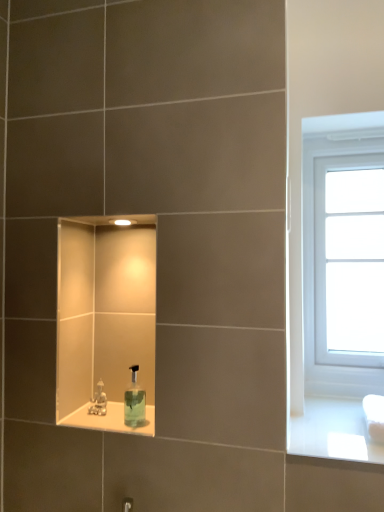
Question: Does transparent plastic soap dispenser at center contain white plastic window at right?

Choices:
 (A) no
 (B) yes

Answer: (A)

Question: Is the depth of transparent plastic soap dispenser at center less than that of white plastic window at right?

Choices:
 (A) yes
 (B) no

Answer: (A)

Question: Is transparent plastic soap dispenser at center next to white plastic window at right?

Choices:
 (A) yes
 (B) no

Answer: (B)

Question: Is transparent plastic soap dispenser at center taller than white plastic window at right?

Choices:
 (A) no
 (B) yes

Answer: (A)

Question: Is transparent plastic soap dispenser at center far away from white plastic window at right?

Choices:
 (A) no
 (B) yes

Answer: (A)

Question: From a real-world perspective, relative to metallic silver faucet at lower center, is transparent plastic soap dispenser at center vertically above or below?

Choices:
 (A) below
 (B) above

Answer: (B)

Question: Considering the positions of transparent plastic soap dispenser at center and metallic silver faucet at lower center in the image, is transparent plastic soap dispenser at center taller or shorter than metallic silver faucet at lower center?

Choices:
 (A) short
 (B) tall

Answer: (B)

Question: In the image, is transparent plastic soap dispenser at center on the left side or the right side of metallic silver faucet at lower center?

Choices:
 (A) right
 (B) left

Answer: (A)

Question: In terms of width, does transparent plastic soap dispenser at center look wider or thinner when compared to metallic silver faucet at lower center?

Choices:
 (A) thin
 (B) wide

Answer: (B)

Question: Which is correct: transparent plastic soap dispenser at center is inside white plastic window at right, or outside of it?

Choices:
 (A) inside
 (B) outside

Answer: (B)

Question: In terms of width, does transparent plastic soap dispenser at center look wider or thinner when compared to white plastic window at right?

Choices:
 (A) thin
 (B) wide

Answer: (A)

Question: Considering the positions of transparent plastic soap dispenser at center and white plastic window at right in the image, is transparent plastic soap dispenser at center bigger or smaller than white plastic window at right?

Choices:
 (A) big
 (B) small

Answer: (B)

Question: Is transparent plastic soap dispenser at center to the left or to the right of white plastic window at right in the image?

Choices:
 (A) right
 (B) left

Answer: (B)

Question: Is metallic silver faucet at lower center spatially inside transparent plastic soap dispenser at center, or outside of it?

Choices:
 (A) outside
 (B) inside

Answer: (A)

Question: From a real-world perspective, is metallic silver faucet at lower center physically located above or below transparent plastic soap dispenser at center?

Choices:
 (A) below
 (B) above

Answer: (A)